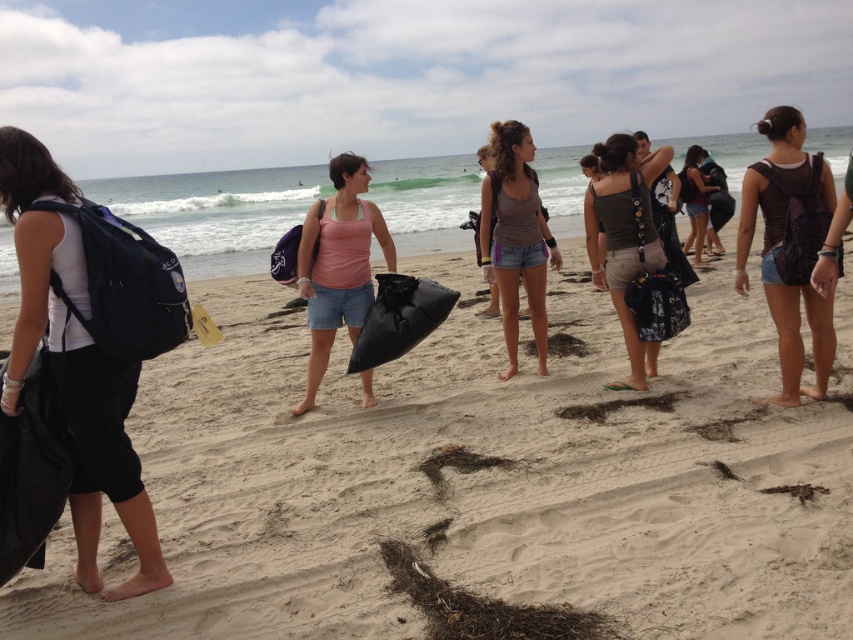
You are a photographer taking a picture of the beach cleanup. You notice the pink fabric tank top at center and the black plastic bag at center in your frame. Which object is closer to the camera?

The pink fabric tank top at center is closer to the camera because the black plastic bag at center is behind it.

You are standing at the beach and see two points marked on the sand. One is at point coordinates point (346,257) and the other at point (372,330). Which point is closer to you?

Point (346,257) is further to the camera than point (372,330), so the point at (372,330) is closer to you.

You are standing at the point with coordinates (480,476) on the beach. What object is located exactly at your current position?

A: The black fabric bag at center is located exactly at the point with coordinates (480,476).